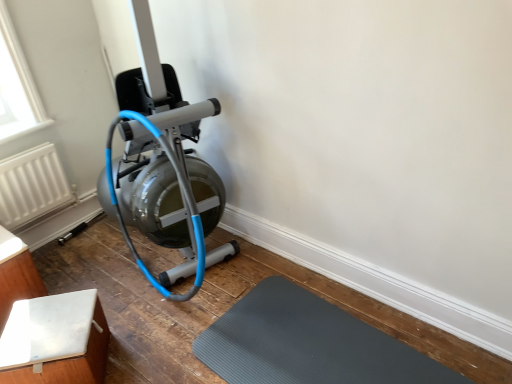
This screenshot has height=384, width=512. Identify the location of free region under gray rubber mat at lower center (from a real-world perspective). (306, 351).